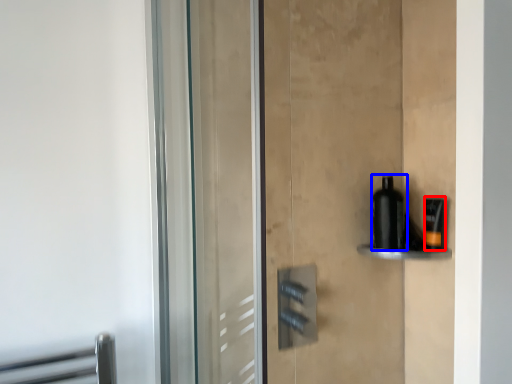
Question: Which point is closer to the camera, toiletry (highlighted by a red box) or bottle (highlighted by a blue box)?

Choices:
 (A) toiletry
 (B) bottle

Answer: (A)